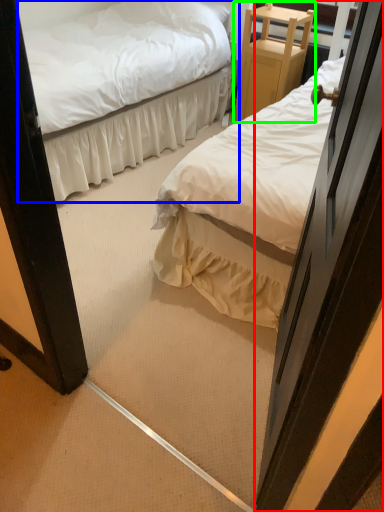
Question: Which object is the farthest from door (highlighted by a red box)? Choose among these: bed (highlighted by a blue box) or furniture (highlighted by a green box).

Choices:
 (A) bed
 (B) furniture

Answer: (B)